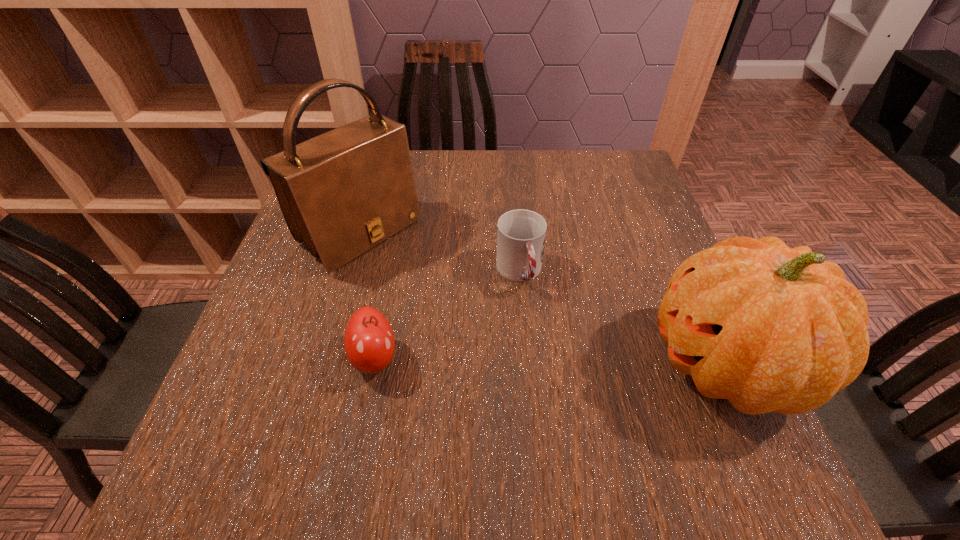
At what (x,y) coordinates should I click in order to perform the action: click on vacant space situated on the handle side of the second object from right to left. Please return your answer as a coordinate pair (x, y). The width and height of the screenshot is (960, 540). Looking at the image, I should click on (577, 431).

Locate an element on the screen. This screenshot has width=960, height=540. vacant area situated 0.230m on the handle side of the second object from right to left is located at coordinates (563, 393).

The height and width of the screenshot is (540, 960). I want to click on blank space located on the front flap of the tallest object, so click(437, 291).

This screenshot has width=960, height=540. I want to click on vacant point located on the front flap of the tallest object, so click(x=464, y=311).

Identify the location of free space located on the front flap of the tallest object. The width and height of the screenshot is (960, 540). (486, 327).

At what (x,y) coordinates should I click in order to perform the action: click on object that is at the far edge. Please return your answer as a coordinate pair (x, y). The image size is (960, 540). Looking at the image, I should click on pyautogui.click(x=343, y=192).

What are the coordinates of `apple at the near edge` in the screenshot? It's located at (369, 342).

The image size is (960, 540). Find the location of `pumpkin located in the near edge section of the desktop`. pumpkin located in the near edge section of the desktop is located at coordinates (772, 329).

At what (x,y) coordinates should I click in order to perform the action: click on object that is at the left edge. Please return your answer as a coordinate pair (x, y). The height and width of the screenshot is (540, 960). Looking at the image, I should click on (343, 192).

I want to click on object that is at the right edge, so click(772, 329).